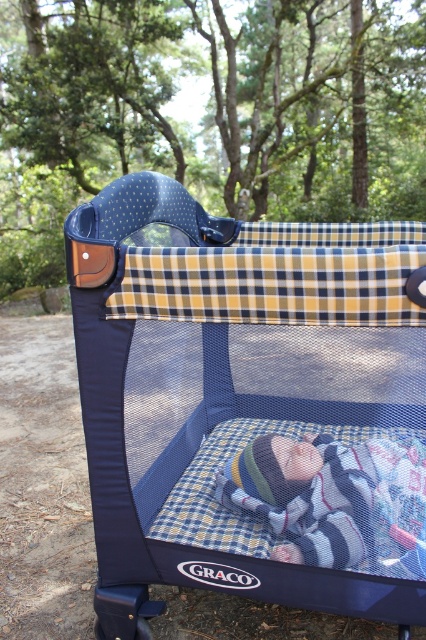
Does navy blue mesh playpen at center have a larger size compared to striped knit hat at center?

Yes.

Is navy blue mesh playpen at center positioned in front of striped knit hat at center?

Yes, it is in front of striped knit hat at center.

Where is `navy blue mesh playpen at center`? navy blue mesh playpen at center is located at coordinates (250, 404).